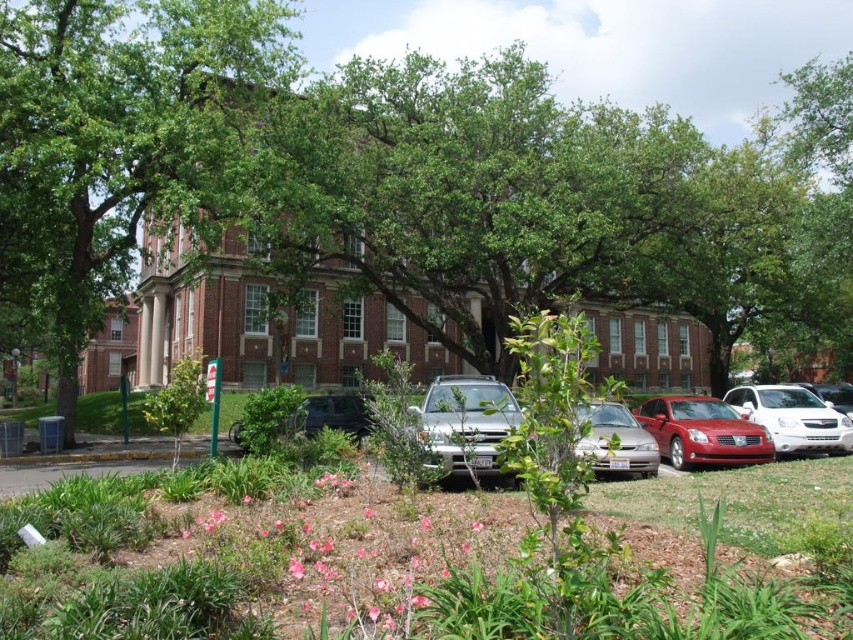
You are a gardener who needs to water the green leafy tree at center and the satin silver sedan at center. Which object should you water first if you want to start from the left side of the scene?

You should water the satin silver sedan at center first because the green leafy tree at center is to the right of it, so the sedan is on the left side.

You are a visitor arriving at the campus and see the green leafy tree at center and the satin silver sedan at center. Which object is higher from the ground?

The green leafy tree at center is above the satin silver sedan at center, so the tree is higher from the ground.